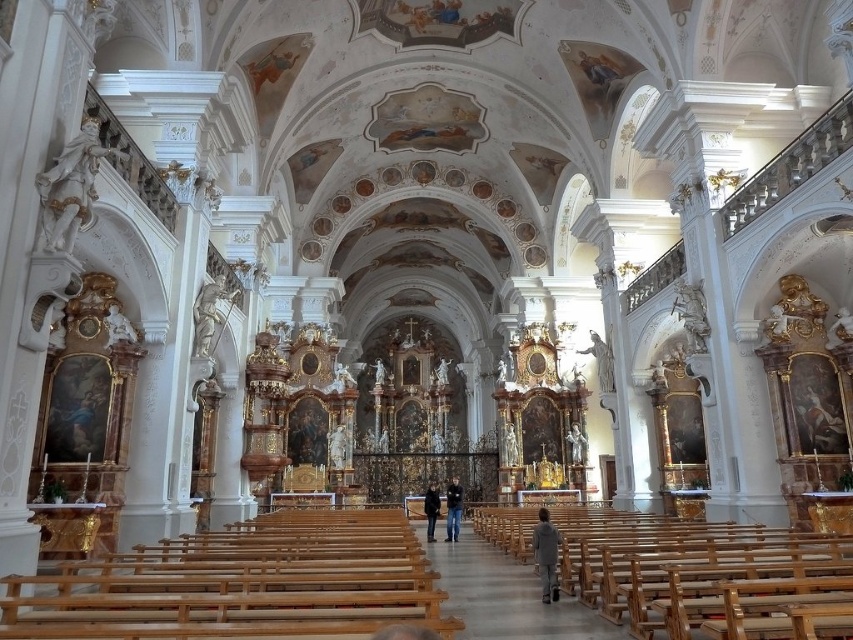
You are a visitor standing at the entrance of the church and notice two items at the center of the image. Which item is shorter in height between the dark blue jeans at center and the black leather jacket at center?

The dark blue jeans at center is not as tall as the black leather jacket at center, so the dark blue jeans at center is shorter in height.